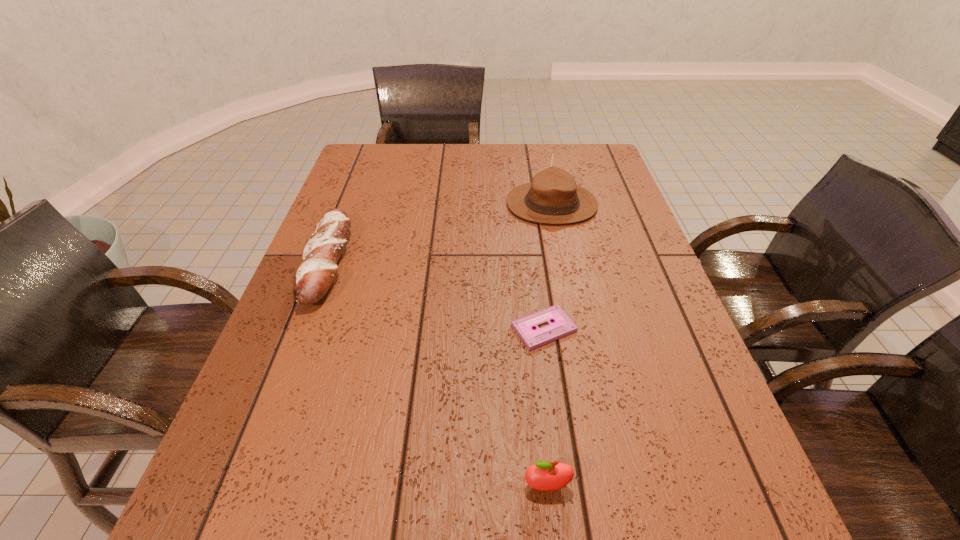
The width and height of the screenshot is (960, 540). Find the location of `vacant space that's between the videotape and the baguet`. vacant space that's between the videotape and the baguet is located at coordinates (436, 295).

Image resolution: width=960 pixels, height=540 pixels. In order to click on empty space that is in between the nearest object and the tallest object in this screenshot , I will do `click(549, 345)`.

Locate an element on the screen. vacant area that lies between the baguet and the fedora is located at coordinates (440, 233).

The image size is (960, 540). What are the coordinates of `free point between the baguet and the nearest object` in the screenshot? It's located at (437, 374).

Identify the location of vacant space in between the nearest object and the videotape. The image size is (960, 540). (545, 407).

Find the location of a particular element. This screenshot has height=540, width=960. unoccupied area between the nearest object and the baguet is located at coordinates (437, 374).

The height and width of the screenshot is (540, 960). I want to click on vacant space that's between the nearest object and the fedora, so click(549, 345).

Identify the location of vacant area that lies between the nearest object and the leftmost object. (437, 374).

Identify which object is located as the third nearest to the baguet. Please provide its 2D coordinates. Your answer should be formatted as a tuple, i.e. [(x, y)], where the tuple contains the x and y coordinates of a point satisfying the conditions above.

[(545, 476)]

I want to click on object that can be found as the closest to the second shortest object, so [562, 325].